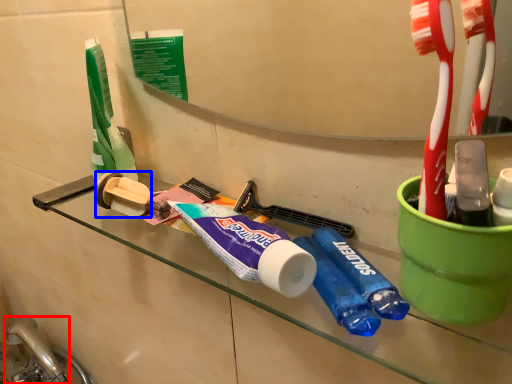
Question: Which point is closer to the camera, faucet (highlighted by a red box) or toilet paper (highlighted by a blue box)?

Choices:
 (A) faucet
 (B) toilet paper

Answer: (B)